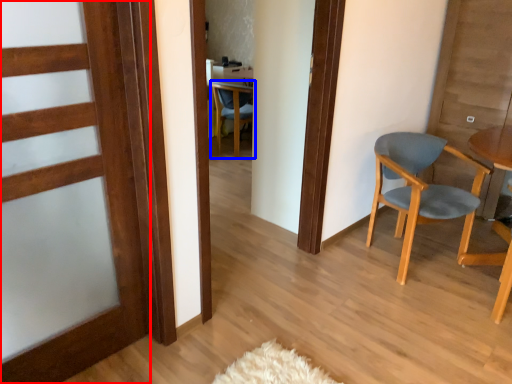
Question: Which object appears farthest to the camera in this image, door (highlighted by a red box) or chair (highlighted by a blue box)?

Choices:
 (A) door
 (B) chair

Answer: (B)